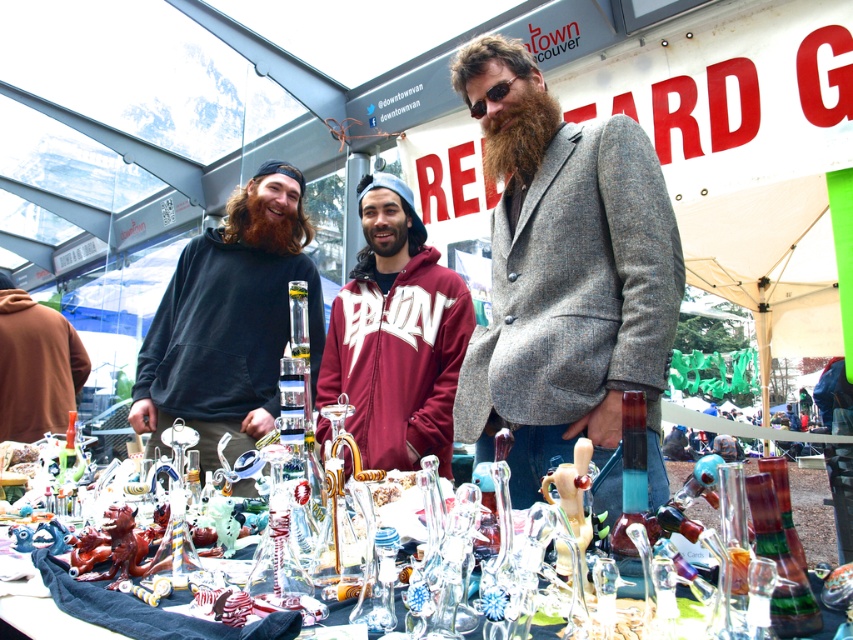
Question: Is maroon fleece at center positioned behind dark brown textured beard at center?

Choices:
 (A) yes
 (B) no

Answer: (B)

Question: Among these objects, which one is nearest to the camera?

Choices:
 (A) brownwoollybeard at center
 (B) dark brown textured beard at center

Answer: (B)

Question: Is matte black hoodie at left in front of brown fuzzy beard at center?

Choices:
 (A) yes
 (B) no

Answer: (A)

Question: Which point is closer to the camera?

Choices:
 (A) matte black hoodie at left
 (B) brown hoodie at left

Answer: (A)

Question: Which point is closer to the camera taking this photo?

Choices:
 (A) (561, 212)
 (B) (9, 360)
 (C) (192, 392)

Answer: (A)

Question: Is dark brown textured beard at center bigger than brown fuzzy beard at center?

Choices:
 (A) yes
 (B) no

Answer: (A)